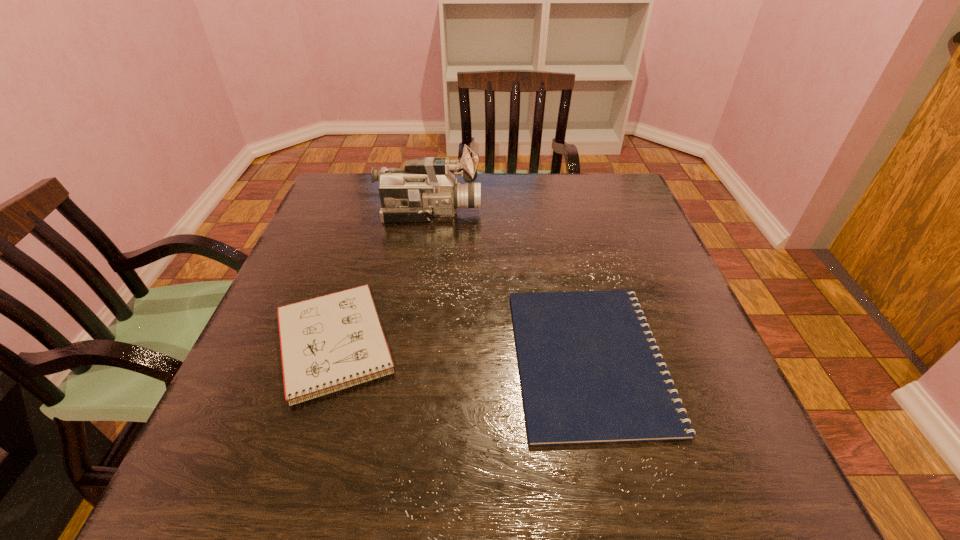
Locate an element on the screen. This screenshot has width=960, height=540. object positioned at the left edge is located at coordinates (328, 343).

Locate an element on the screen. The height and width of the screenshot is (540, 960). object present at the right edge is located at coordinates (590, 370).

Find the location of a particular element. Image resolution: width=960 pixels, height=540 pixels. free point at the far edge is located at coordinates (541, 201).

I want to click on vacant region at the left edge of the desktop, so click(218, 428).

Where is `free region at the right edge of the desktop`? The height and width of the screenshot is (540, 960). free region at the right edge of the desktop is located at coordinates (661, 248).

Where is `vacant space at the far left corner`? The height and width of the screenshot is (540, 960). vacant space at the far left corner is located at coordinates (370, 190).

This screenshot has width=960, height=540. In the image, there is a desktop. What are the coordinates of `blank space at the far right corner` in the screenshot? It's located at (587, 202).

Identify the location of free space at the near right corner of the desktop. (756, 471).

At what (x,y) coordinates should I click in order to perform the action: click on free space between the tallest object and the rightmost object. Please return your answer as a coordinate pair (x, y). Image resolution: width=960 pixels, height=540 pixels. Looking at the image, I should click on click(x=510, y=285).

This screenshot has height=540, width=960. Find the location of `free area in between the farthest object and the left notepad`. free area in between the farthest object and the left notepad is located at coordinates (382, 278).